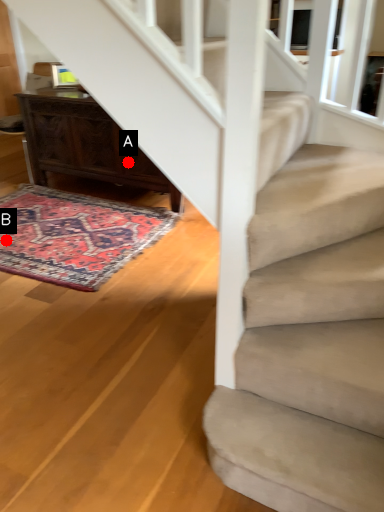
Question: Two points are circled on the image, labeled by A and B beside each circle. Among these points, which one is nearest to the camera?

Choices:
 (A) A is closer
 (B) B is closer

Answer: (B)